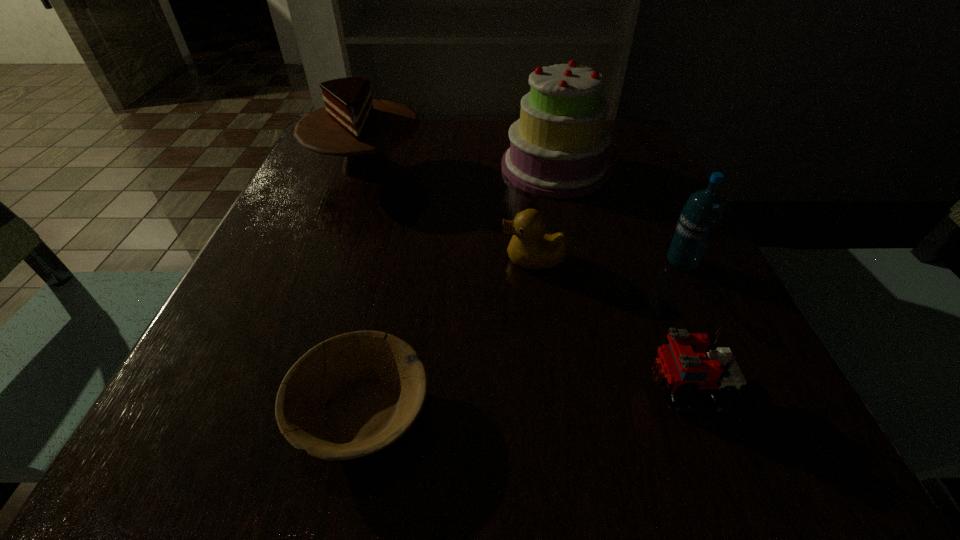
Identify the location of free space at the near left corner. (144, 443).

This screenshot has height=540, width=960. Identify the location of vacant area between the left cake and the Lego. (526, 276).

In order to click on empty location between the water bottle and the Lego in this screenshot , I will do `click(684, 325)`.

Where is `unoccupied area between the duckling and the taller cake`? This screenshot has width=960, height=540. unoccupied area between the duckling and the taller cake is located at coordinates (544, 214).

Image resolution: width=960 pixels, height=540 pixels. In order to click on free area in between the duckling and the shortest object in this screenshot , I will do `click(447, 335)`.

Identify the location of free spot between the Lego and the shortest object. (523, 399).

This screenshot has width=960, height=540. Identify the location of unoccupied position between the tallest object and the duckling. (544, 214).

Find the location of a particular element. This screenshot has width=960, height=540. empty space between the left cake and the right cake is located at coordinates (461, 167).

The width and height of the screenshot is (960, 540). Identify the location of vacant space that is in between the water bottle and the duckling. (608, 261).

Identify the location of free space that is in between the Lego and the shorter cake. The width and height of the screenshot is (960, 540). (526, 276).